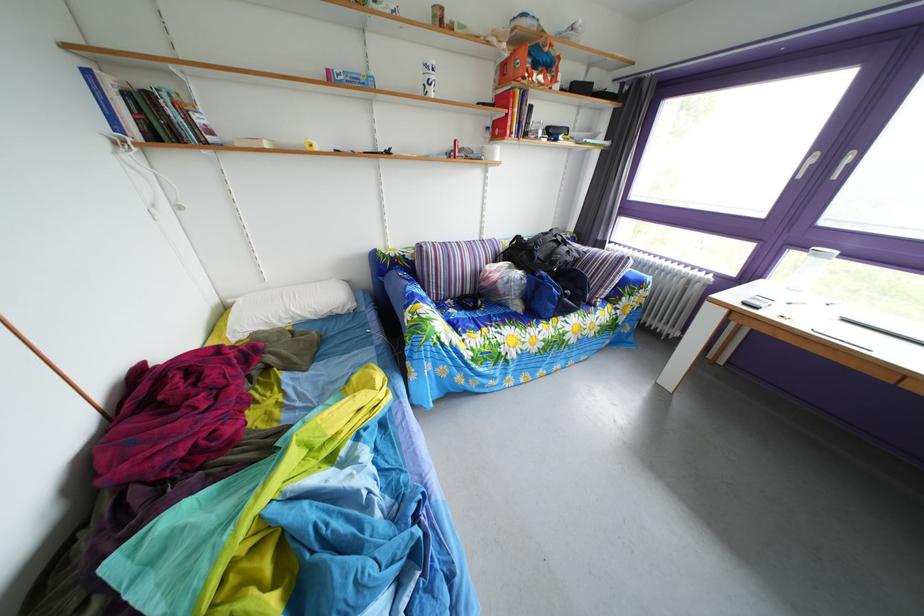
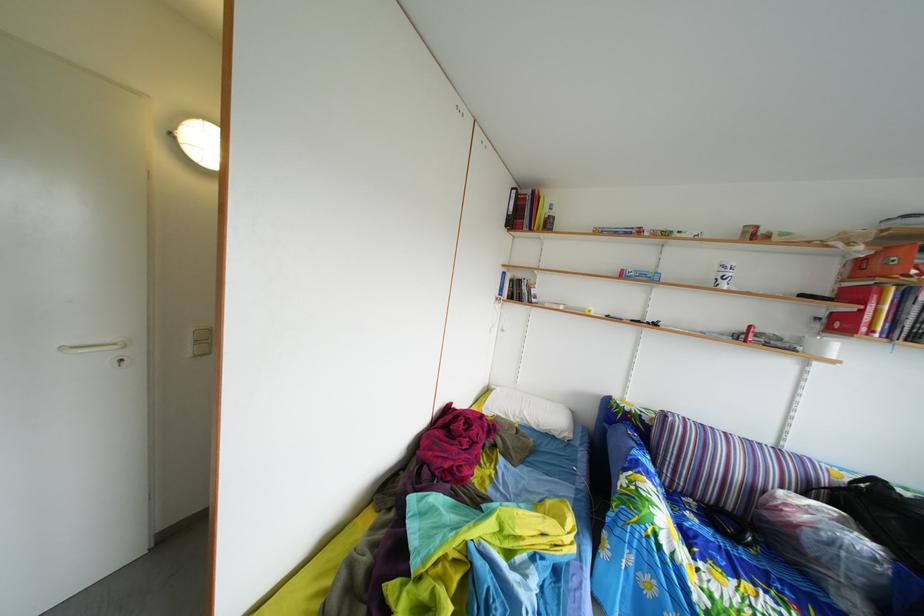
Where in the second image is the point corresponding to pixel 524 57 from the first image?

(892, 256)